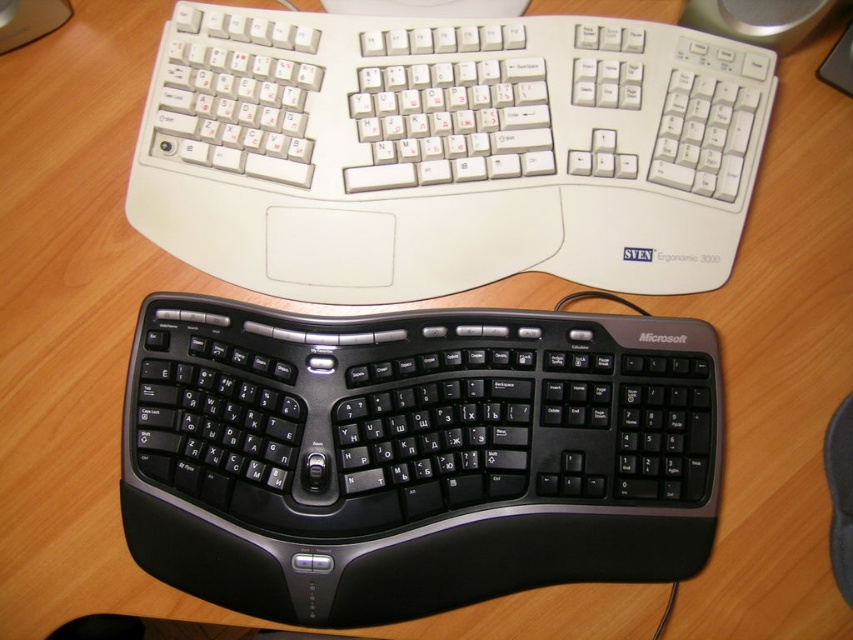
Question: Can you confirm if black plastic keyboard at center is bigger than white plastic keyboard at upper center?

Choices:
 (A) yes
 (B) no

Answer: (A)

Question: From the image, what is the correct spatial relationship of black plastic keyboard at center in relation to white plastic keyboard at upper center?

Choices:
 (A) left
 (B) right

Answer: (A)

Question: Does black plastic keyboard at center appear on the left side of white plastic keyboard at upper center?

Choices:
 (A) yes
 (B) no

Answer: (A)

Question: Which of the following is the farthest from the observer?

Choices:
 (A) (520, 104)
 (B) (287, 317)

Answer: (A)

Question: Which point is farther to the camera?

Choices:
 (A) (569, 83)
 (B) (160, 371)

Answer: (A)

Question: Which object appears farthest from the camera in this image?

Choices:
 (A) black plastic keyboard at center
 (B) white plastic keyboard at upper center

Answer: (B)